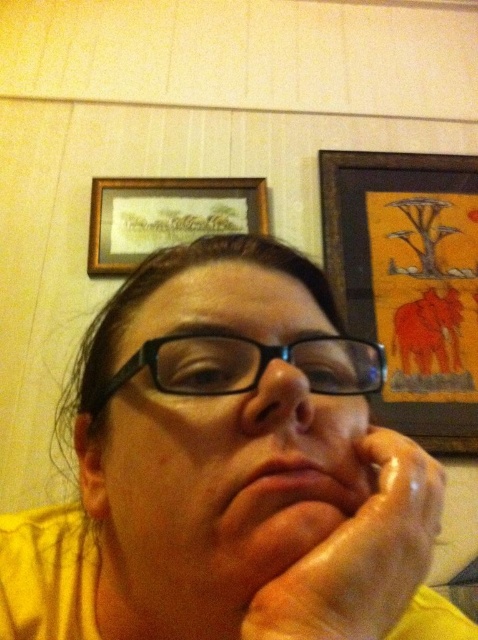
You are an interior designer assessing the placement of items in the scene. The black plastic glasses at center and the wooden frame at upper center are both on the wall. Which object is positioned closer to the observer?

The black plastic glasses at center are closer to the observer than the wooden frame at upper center.

You are a delivery person who needs to place a package between the black plastic glasses at center and the wooden frame at upper center. The package requires a space of 1 meter. Is there enough space between them?

The distance between the black plastic glasses at center and the wooden frame at upper center is 1.23 meters, so yes, there is enough space to place the package between them since the required space is 1 meter.